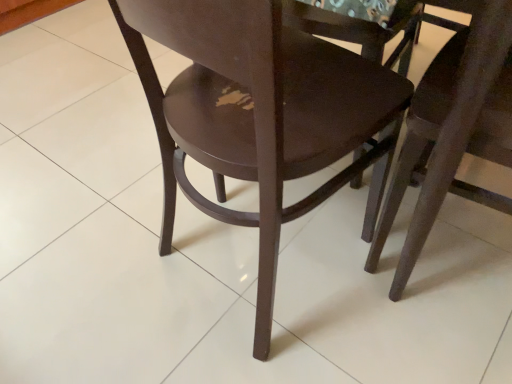
At what (x,y) coordinates should I click in order to perform the action: click on free spot to the left of glossy wood chair at center, placed as the 1th chair when sorted from left to right. Please return your answer as a coordinate pair (x, y). The image size is (512, 384). Looking at the image, I should click on (109, 268).